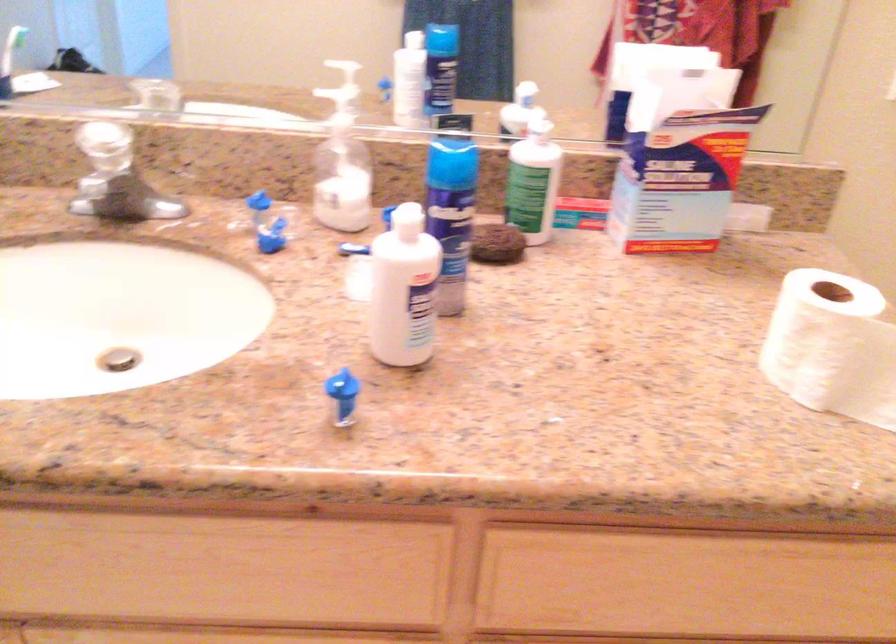
Where is `chrome faucet handle`? This screenshot has width=896, height=644. chrome faucet handle is located at coordinates (116, 178).